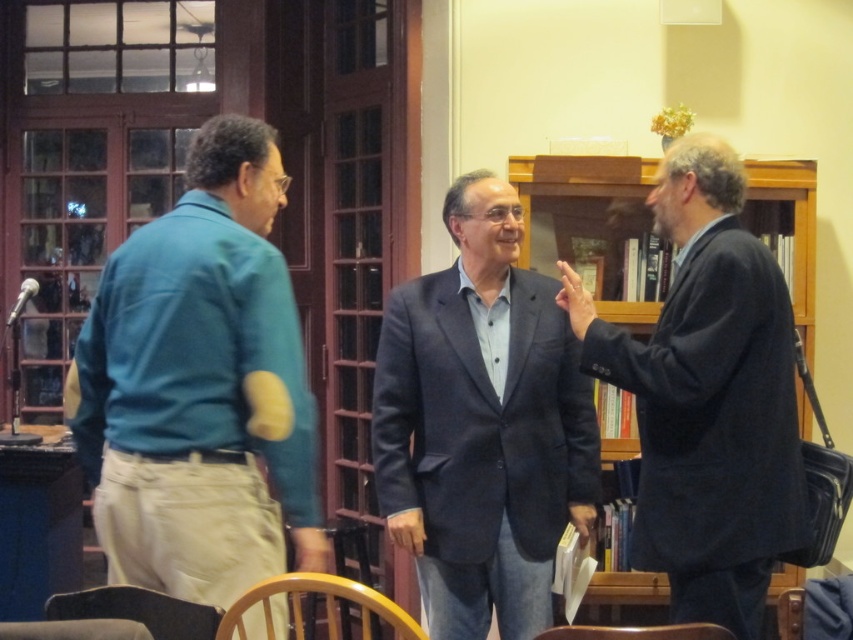
Can you confirm if teal fabric shirt at left is taller than dark blue suit at right?

Incorrect, teal fabric shirt at left's height is not larger of dark blue suit at right's.

Is point (138, 353) closer to camera compared to point (665, 396)?

Yes.

Locate an element on the screen. This screenshot has height=640, width=853. teal fabric shirt at left is located at coordinates pos(200,385).

Which is behind, point (183, 538) or point (556, 634)?

Point (183, 538)

Which is in front, point (281, 376) or point (657, 637)?

Positioned in front is point (657, 637).

Between point (137, 467) and point (677, 634), which one is positioned in front?

Point (677, 634) is in front.

You are a GUI agent. You are given a task and a screenshot of the screen. Output one action in this format:
    pyautogui.click(x=<x>, y=<y>)
    Task: Click on the teal fabric shirt at left
    The height and width of the screenshot is (640, 853).
    Given the screenshot: What is the action you would take?
    pyautogui.click(x=200, y=385)

Is dark blue suit at center shorter than dark brown leather chair at lower left?

No, dark blue suit at center is not shorter than dark brown leather chair at lower left.

The image size is (853, 640). What do you see at coordinates (482, 424) in the screenshot? I see `dark blue suit at center` at bounding box center [482, 424].

The width and height of the screenshot is (853, 640). Identify the location of dark blue suit at center. (482, 424).